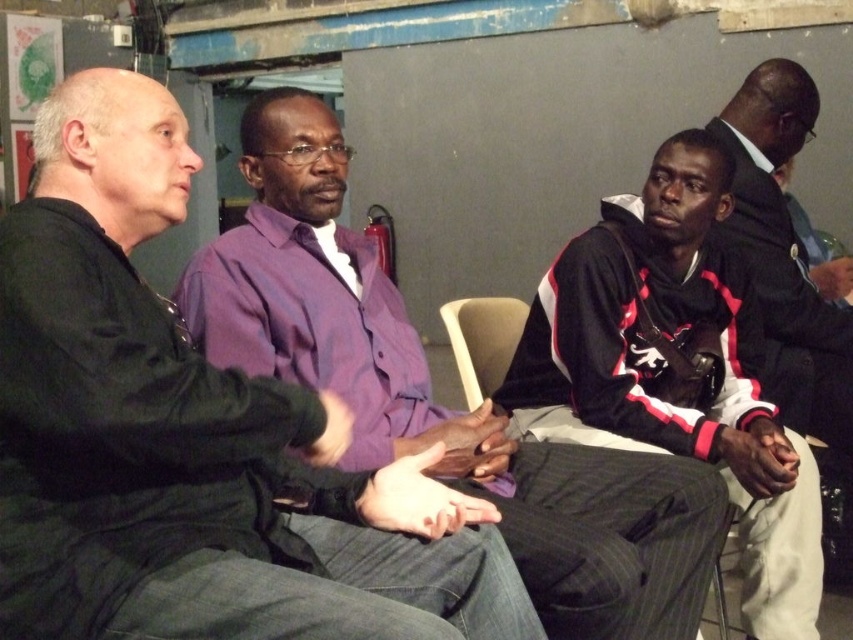
Does purple button-down shirt at center have a greater height compared to black leather jacket at right?

Incorrect, purple button-down shirt at center's height is not larger of black leather jacket at right's.

Between point (503, 426) and point (775, 278), which one is positioned behind?

Positioned behind is point (775, 278).

Identify the location of purple button-down shirt at center. This screenshot has width=853, height=640. (431, 396).

What are the coordinates of `beige fabric chair at center` in the screenshot? It's located at click(482, 339).

Is point (494, 310) positioned before point (463, 316)?

No, (494, 310) is behind (463, 316).

Who is more forward, (492, 339) or (491, 381)?

Point (491, 381)

The height and width of the screenshot is (640, 853). In order to click on beige fabric chair at center in this screenshot , I will do `click(482, 339)`.

Does point (733, 500) come behind point (788, 301)?

No.

Which is below, black jersey at center or black leather jacket at right?

Positioned lower is black jersey at center.

The width and height of the screenshot is (853, 640). Identify the location of black jersey at center. (674, 371).